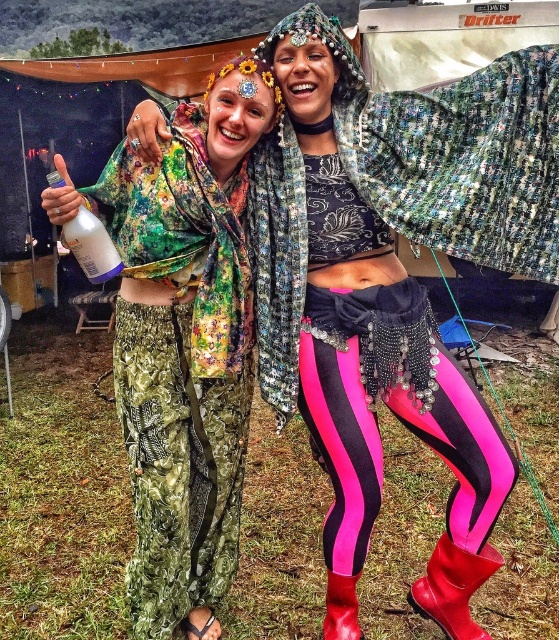
Question: Observing the image, what is the correct spatial positioning of white plastic bottle at left in reference to red leather boot at lower right?

Choices:
 (A) right
 (B) left

Answer: (B)

Question: Is neon pink spandex leggings at center positioned before red rubber boot at lower right?

Choices:
 (A) no
 (B) yes

Answer: (B)

Question: Which point is farther to the camera?

Choices:
 (A) (418, 284)
 (B) (115, 268)
 (C) (187, 506)

Answer: (A)

Question: Considering the real-world distances, which object is closest to the shiny sequined shawl at upper right?

Choices:
 (A) red rubber boot at lower right
 (B) red leather boot at lower right

Answer: (A)

Question: Which point appears closest to the camera in this image?

Choices:
 (A) (468, 634)
 (B) (335, 634)
 (C) (111, 273)

Answer: (C)

Question: Does shiny sequined shawl at upper right come in front of green floral fabric skirt at lower left?

Choices:
 (A) no
 (B) yes

Answer: (B)